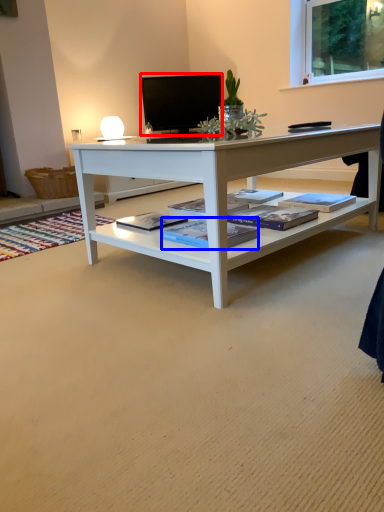
Question: Which of the following is the farthest to the observer, television (highlighted by a red box) or book (highlighted by a blue box)?

Choices:
 (A) television
 (B) book

Answer: (A)